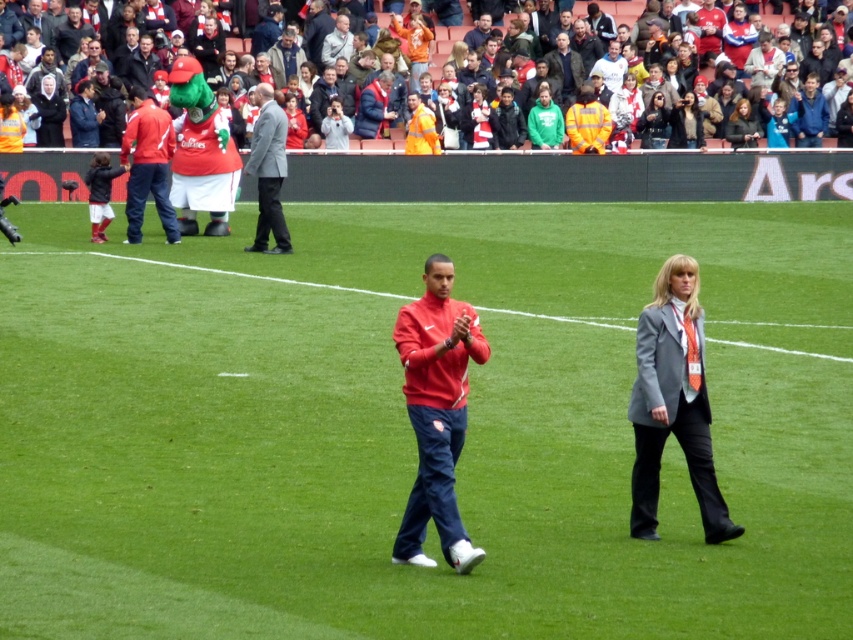
Question: Does green grass at center have a smaller size compared to gray fabric jacket at upper center?

Choices:
 (A) no
 (B) yes

Answer: (A)

Question: Does red matte jacket at center have a greater width compared to red fabric crowd at upper center?

Choices:
 (A) no
 (B) yes

Answer: (A)

Question: Which of the following is the farthest from the observer?

Choices:
 (A) green grass at center
 (B) red matte jacket at center
 (C) red fabric crowd at upper center

Answer: (C)

Question: Estimate the real-world distances between objects in this image. Which object is farther from the matte red jacket at upper left?

Choices:
 (A) red matte jacket at center
 (B) red fabric crowd at upper center
 (C) gray fabric jacket at lower right
 (D) green grass at center

Answer: (A)

Question: Does matte red jacket at upper left have a larger size compared to gray suit at center?

Choices:
 (A) yes
 (B) no

Answer: (B)

Question: Among these points, which one is nearest to the camera?

Choices:
 (A) (627, 17)
 (B) (329, 54)

Answer: (B)